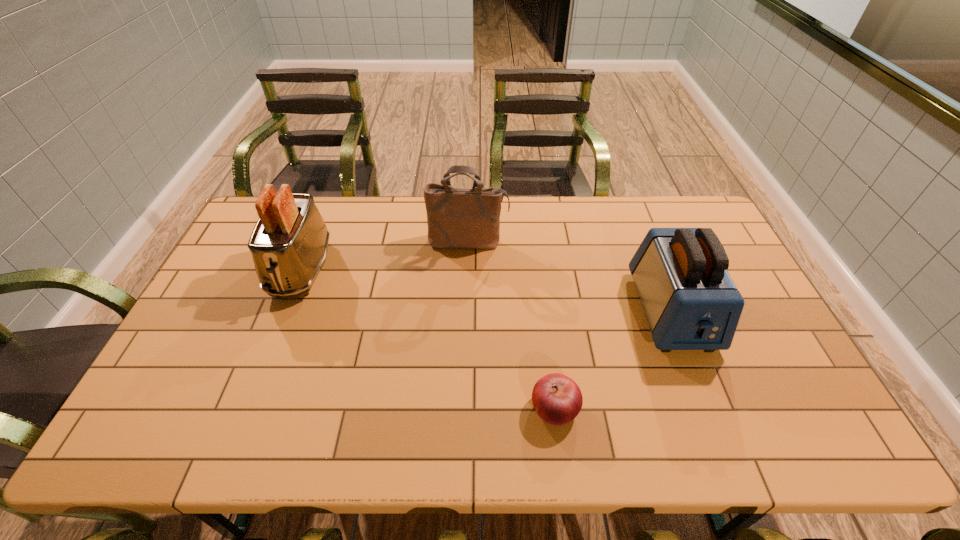
This screenshot has width=960, height=540. I want to click on shoulder bag, so 457,218.

Image resolution: width=960 pixels, height=540 pixels. What are the coordinates of `the left toaster` in the screenshot? It's located at (289, 243).

Where is `the rightmost object`? the rightmost object is located at coordinates (690, 301).

At what (x,y) coordinates should I click in order to perform the action: click on the second object from right to left. Please return your answer as a coordinate pair (x, y). This screenshot has width=960, height=540. Looking at the image, I should click on (557, 399).

This screenshot has width=960, height=540. Identify the location of the shortest object. (557, 399).

This screenshot has height=540, width=960. In order to click on vacant region located 0.180m on the front-facing side of the shoulder bag in this screenshot , I will do `click(467, 294)`.

The height and width of the screenshot is (540, 960). In order to click on free spot located 0.370m on the side of the leftmost object with the control lever in this screenshot , I will do `click(238, 429)`.

Where is `free space located on the front-facing side of the rightmost object`? Image resolution: width=960 pixels, height=540 pixels. free space located on the front-facing side of the rightmost object is located at coordinates (716, 427).

Identify the location of free region located 0.290m on the right of the shortest object. pyautogui.click(x=699, y=409).

Where is `shoulder bag located at the far edge`? This screenshot has height=540, width=960. shoulder bag located at the far edge is located at coordinates (457, 218).